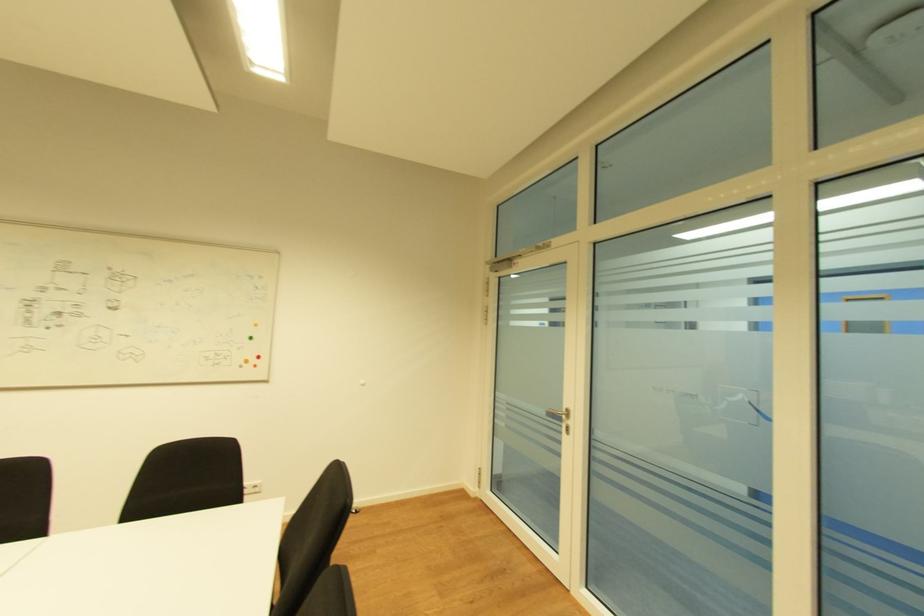
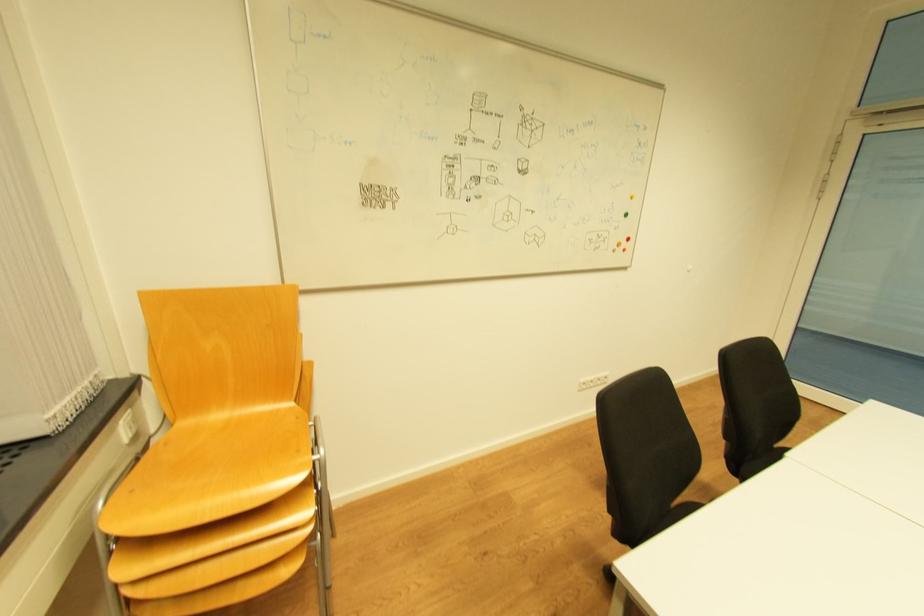
Question: The images are taken continuously from a first-person perspective. In which direction are you moving?

Choices:
 (A) Left
 (B) Right
 (C) Forward
 (D) Backward

Answer: (A)